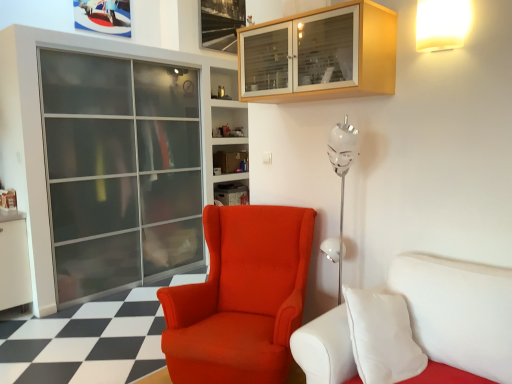
I want to click on wooden cabinet at upper center, so click(x=348, y=56).

You are a GUI agent. You are given a task and a screenshot of the screen. Output one action in this format:
    pyautogui.click(x=<x>, y=<y>)
    Task: Click on the white leather studio couch at lower right
    
    Given the screenshot: What is the action you would take?
    pyautogui.click(x=457, y=311)

The image size is (512, 384). What do you see at coordinates (441, 24) in the screenshot? I see `white matte wall lamp at upper right` at bounding box center [441, 24].

At what (x,y) coordinates should I click in order to perform the action: click on satin orange armchair at center. Please return your answer as a coordinate pair (x, y). The height and width of the screenshot is (384, 512). Looking at the image, I should click on (241, 297).

What is the approximate width of matte plastic shelf at center?

The width of matte plastic shelf at center is 7.54 inches.

You are a GUI agent. You are given a task and a screenshot of the screen. Output one action in this format:
    pyautogui.click(x=<x>, y=<y>)
    Task: Click on the transparent glass screen door at left
    The height and width of the screenshot is (384, 512).
    Given the screenshot: What is the action you would take?
    pyautogui.click(x=120, y=169)

Could you tell me if wooden cabinet at upper center is facing transparent glass screen door at left?

No, wooden cabinet at upper center is not aimed at transparent glass screen door at left.

In the scene shown: Considering the sizes of objects wooden cabinet at upper center and transparent glass screen door at left in the image provided, who is wider, wooden cabinet at upper center or transparent glass screen door at left?

transparent glass screen door at left is wider.

From the image's perspective, would you say wooden cabinet at upper center is shown under transparent glass screen door at left?

No, from the image's perspective, wooden cabinet at upper center is not below transparent glass screen door at left.

Can you confirm if wooden cabinet at upper center is shorter than transparent glass screen door at left?

Indeed, wooden cabinet at upper center has a lesser height compared to transparent glass screen door at left.

Where is `shelf located above the satin orange armchair at center (from a real-world perspective)`? The width and height of the screenshot is (512, 384). shelf located above the satin orange armchair at center (from a real-world perspective) is located at coordinates (231, 193).

Which object is positioned more to the right, matte plastic shelf at center or satin orange armchair at center?

satin orange armchair at center is more to the right.

Is matte plastic shelf at center bigger or smaller than satin orange armchair at center?

Considering their sizes, matte plastic shelf at center takes up less space than satin orange armchair at center.

How distant is white leather studio couch at lower right from white matte wall lamp at upper right?

They are 1.19 meters apart.

Is white leather studio couch at lower right aimed at white matte wall lamp at upper right?

No.

This screenshot has width=512, height=384. In the image, there is a white leather studio couch at lower right. Identify the location of light fixture above it (from the image's perspective). (441, 24).

Is wooden cabinet at upper center taller or shorter than white leather studio couch at lower right?

Clearly, wooden cabinet at upper center is shorter compared to white leather studio couch at lower right.

Find the location of `studio couch located below the wooden cabinet at upper center (from the image's perspective)`. studio couch located below the wooden cabinet at upper center (from the image's perspective) is located at coordinates (457, 311).

Does wooden cabinet at upper center appear on the right side of white leather studio couch at lower right?

In fact, wooden cabinet at upper center is to the left of white leather studio couch at lower right.

From the image's perspective, who appears lower, wooden cabinet at upper center or white leather studio couch at lower right?

white leather studio couch at lower right appears lower in the image.

From a real-world perspective, is white leather studio couch at lower right positioned above or below transparent glass screen door at left?

In terms of real-world spatial position, white leather studio couch at lower right is below transparent glass screen door at left.

Is transparent glass screen door at left at the back of white leather studio couch at lower right?

No, white leather studio couch at lower right's orientation is not away from transparent glass screen door at left.

Locate an element on the screen. This screenshot has height=384, width=512. screen door behind the white leather studio couch at lower right is located at coordinates (120, 169).

Which of these two, white leather studio couch at lower right or transparent glass screen door at left, is bigger?

Bigger between the two is transparent glass screen door at left.

Which point is more forward, (233, 192) or (97, 230)?

The point (97, 230) is closer to the camera.

Between matte plastic shelf at center and transparent glass screen door at left, which one appears on the left side from the viewer's perspective?

transparent glass screen door at left.

Consider the image. Is matte plastic shelf at center oriented away from transparent glass screen door at left?

No, transparent glass screen door at left is not at the back of matte plastic shelf at center.

Would you say matte plastic shelf at center is outside transparent glass screen door at left?

matte plastic shelf at center is positioned outside transparent glass screen door at left.

Are matte plastic shelf at center and white matte wall lamp at upper right beside each other?

No.

In terms of size, does matte plastic shelf at center appear bigger or smaller than white matte wall lamp at upper right?

matte plastic shelf at center is bigger than white matte wall lamp at upper right.

Is matte plastic shelf at center wider than white matte wall lamp at upper right?

Yes, matte plastic shelf at center is wider than white matte wall lamp at upper right.

Considering the points (241, 189) and (454, 47), which point is in front, point (241, 189) or point (454, 47)?

Positioned in front is point (454, 47).

At what (x,y) coordinates should I click in order to perform the action: click on screen door that is on the left side of wooden cabinet at upper center. Please return your answer as a coordinate pair (x, y). Looking at the image, I should click on (120, 169).

Identify the location of chair below the matte plastic shelf at center (from the image's perspective). This screenshot has width=512, height=384. (241, 297).

Considering their positions, is wooden cabinet at upper center positioned further to white leather studio couch at lower right than white matte wall lamp at upper right?

Among the two, white matte wall lamp at upper right is located further to white leather studio couch at lower right.

From the image, which object appears to be farther from white leather studio couch at lower right, transparent glass screen door at left or satin orange armchair at center?

transparent glass screen door at left lies further to white leather studio couch at lower right than the other object.

When comparing their distances from matte plastic shelf at center, does white leather studio couch at lower right or satin orange armchair at center seem further?

white leather studio couch at lower right.

Which object lies further to the anchor point white matte wall lamp at upper right, wooden cabinet at upper center or transparent glass screen door at left?

Among the two, transparent glass screen door at left is located further to white matte wall lamp at upper right.

When comparing their distances from matte plastic shelf at center, does satin orange armchair at center or white matte wall lamp at upper right seem closer?

satin orange armchair at center is positioned closer to the anchor matte plastic shelf at center.

When comparing their distances from wooden cabinet at upper center, does white matte wall lamp at upper right or transparent glass screen door at left seem further?

The object further to wooden cabinet at upper center is transparent glass screen door at left.

From the image, which object appears to be nearer to satin orange armchair at center, transparent glass screen door at left or white matte wall lamp at upper right?

white matte wall lamp at upper right.

Estimate the real-world distances between objects in this image. Which object is further from matte plastic shelf at center, transparent glass screen door at left or wooden cabinet at upper center?

The object further to matte plastic shelf at center is wooden cabinet at upper center.

At what (x,y) coordinates should I click in order to perform the action: click on chair between white leather studio couch at lower right and matte plastic shelf at center from front to back. Please return your answer as a coordinate pair (x, y). The image size is (512, 384). Looking at the image, I should click on (241, 297).

Where is `screen door located between white matte wall lamp at upper right and matte plastic shelf at center in the depth direction`? This screenshot has width=512, height=384. screen door located between white matte wall lamp at upper right and matte plastic shelf at center in the depth direction is located at coordinates (120, 169).

The height and width of the screenshot is (384, 512). Find the location of `cabinetry that lies between white matte wall lamp at upper right and white leather studio couch at lower right from top to bottom`. cabinetry that lies between white matte wall lamp at upper right and white leather studio couch at lower right from top to bottom is located at coordinates (348, 56).

Locate an element on the screen. The image size is (512, 384). screen door between wooden cabinet at upper center and matte plastic shelf at center in the front-back direction is located at coordinates (120, 169).